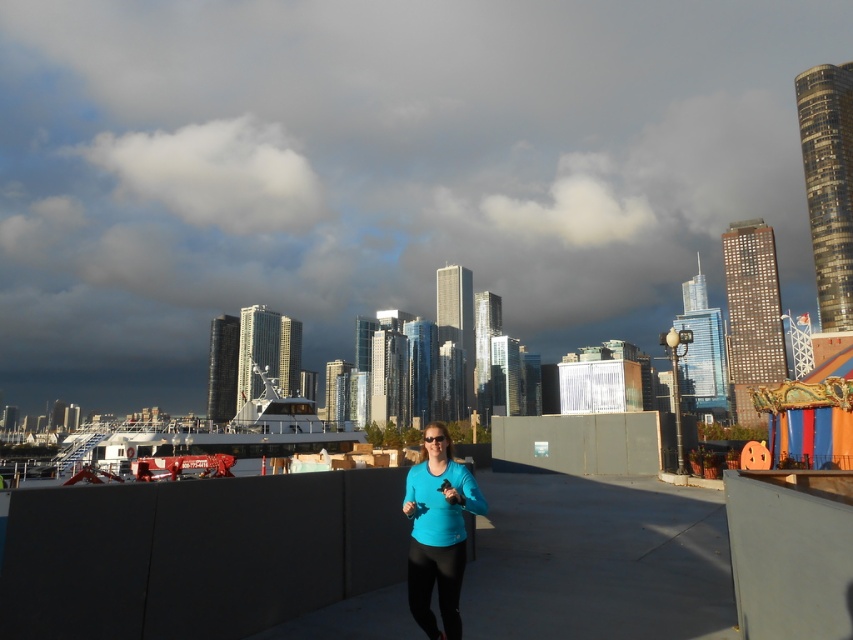
Between point (267, 144) and point (471, 484), which one is positioned behind?

The point (267, 144) is more distant.

Does point (225, 140) lie in front of point (430, 568)?

No.

What are the coordinates of `white fluffy cloud at upper left` in the screenshot? It's located at (215, 173).

Where is `white fluffy cloud at upper left`? white fluffy cloud at upper left is located at coordinates (215, 173).